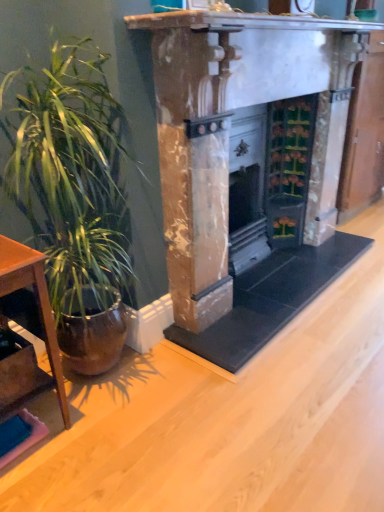
This screenshot has height=512, width=384. I want to click on vacant space in front of green glossy plant at left, so click(115, 459).